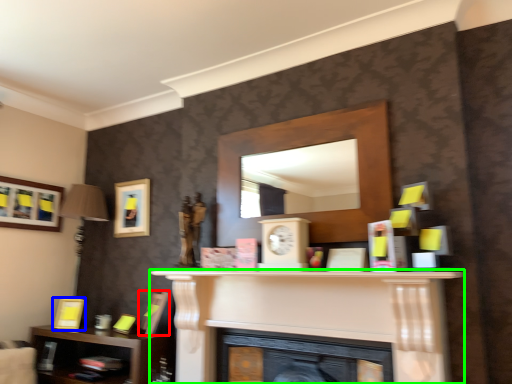
Question: Considering the real-world distances, which object is farthest from picture frame (highlighted by a red box)? picture frame (highlighted by a blue box) or fireplace (highlighted by a green box)?

Choices:
 (A) picture frame
 (B) fireplace

Answer: (B)